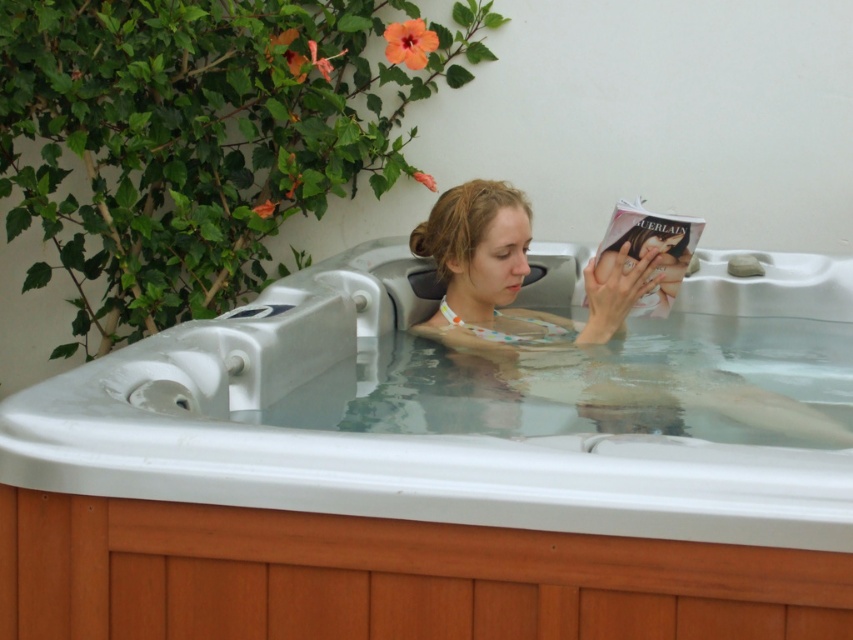
Does wooden hot tub at center have a greater width compared to polka dot swimsuit at center?

Yes.

Is point (78, 518) less distant than point (467, 317)?

Yes, it is in front of point (467, 317).

Identify the location of wooden hot tub at center. (444, 470).